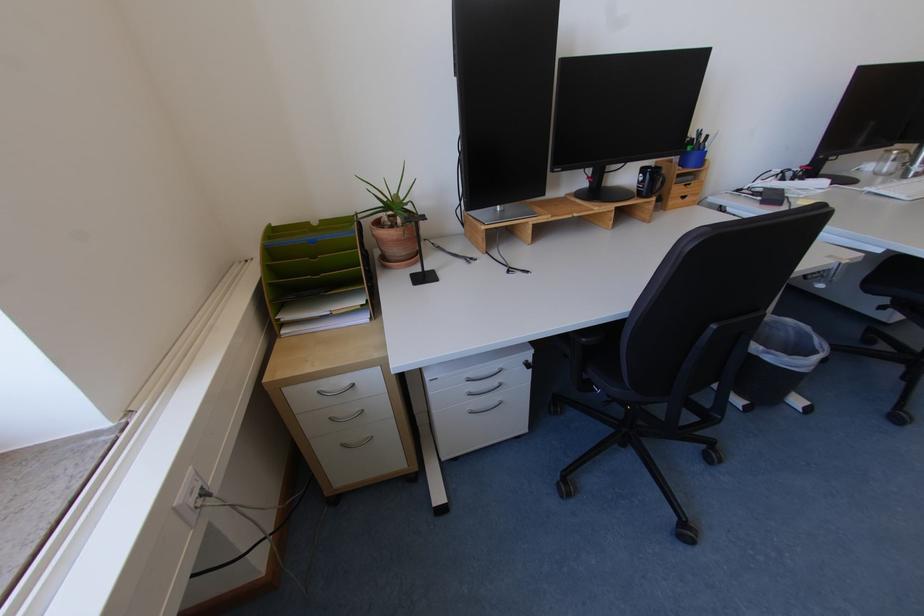
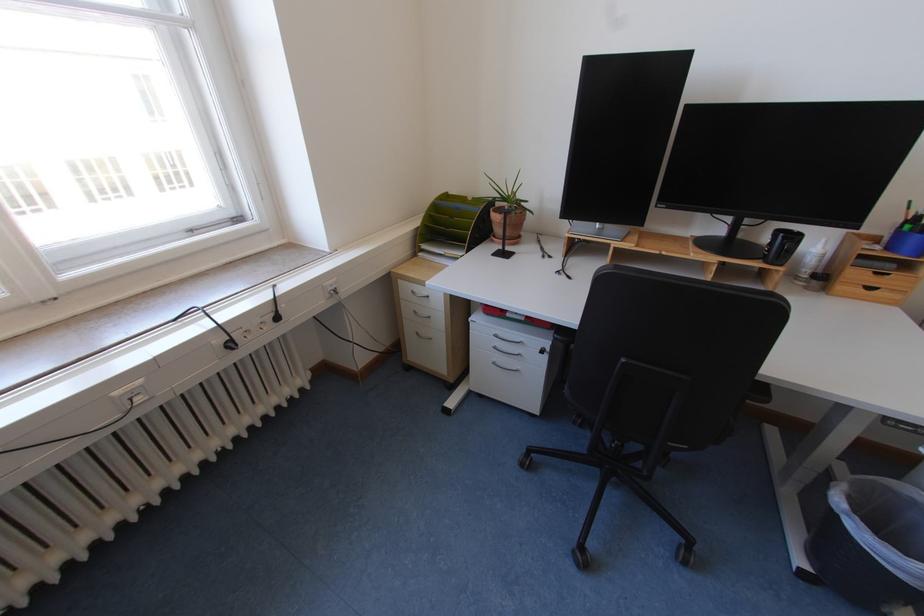
Where in the second image is the point corresponding to point (390, 206) from the first image?

(506, 197)